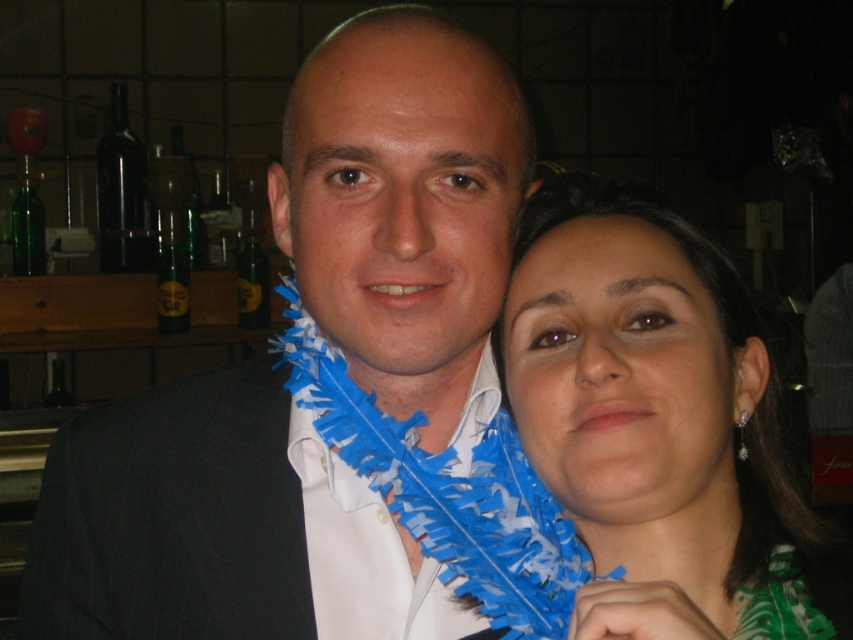
In the scene shown: Is matte black suit at center wider than blue feather boa at right?

Yes.

Based on the photo, does matte black suit at center appear on the left side of blue feather boa at right?

Correct, you'll find matte black suit at center to the left of blue feather boa at right.

Image resolution: width=853 pixels, height=640 pixels. Describe the element at coordinates (219, 525) in the screenshot. I see `matte black suit at center` at that location.

In order to click on matte black suit at center in this screenshot , I will do `click(219, 525)`.